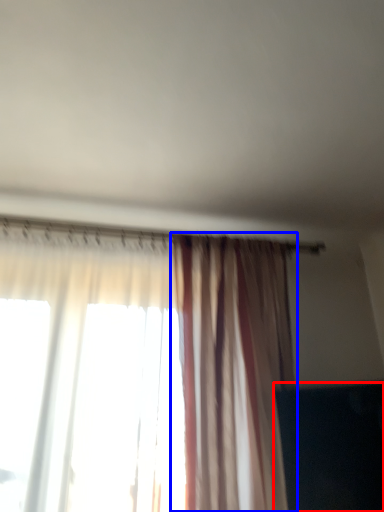
Question: Among these objects, which one is nearest to the camera, dark (highlighted by a red box) or curtain (highlighted by a blue box)?

Choices:
 (A) dark
 (B) curtain

Answer: (B)